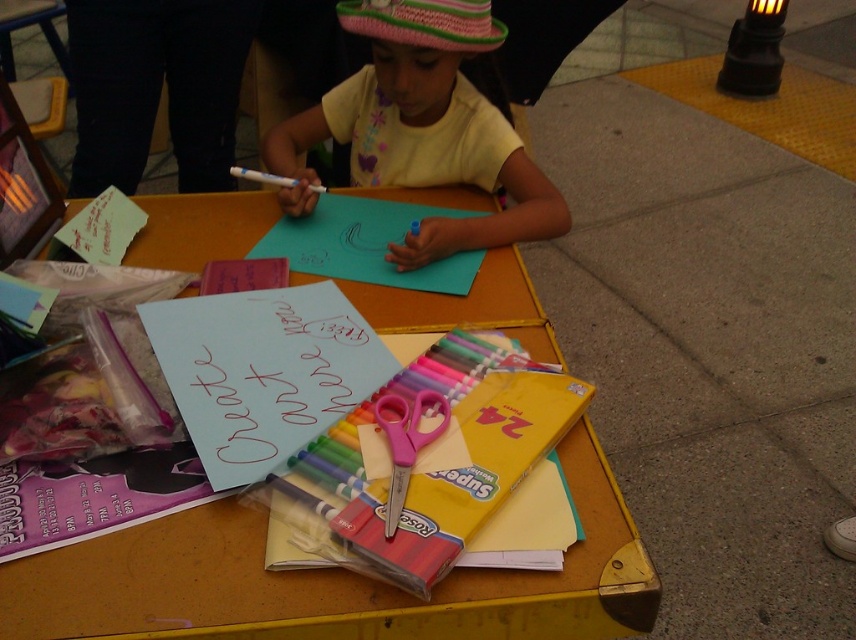
Question: Which object is closer to the camera taking this photo?

Choices:
 (A) yellow cotton shirt at center
 (B) pink plastic scissors at center
 (C) white matte marker at center
 (D) yellow cardboard table at center

Answer: (D)

Question: Can you confirm if pink plastic scissors at center is positioned above white matte marker at center?

Choices:
 (A) no
 (B) yes

Answer: (A)

Question: Which of the following is the closest to the observer?

Choices:
 (A) (317, 186)
 (B) (438, 4)

Answer: (B)

Question: Can you confirm if yellow cardboard table at center is positioned to the right of yellow cotton shirt at center?

Choices:
 (A) no
 (B) yes

Answer: (A)

Question: Which point is closer to the camera taking this photo?

Choices:
 (A) (265, 180)
 (B) (187, 634)
 (C) (406, 404)
 (D) (443, 72)

Answer: (B)

Question: Observing the image, what is the correct spatial positioning of yellow cardboard table at center in reference to pink plastic scissors at center?

Choices:
 (A) above
 (B) below

Answer: (A)